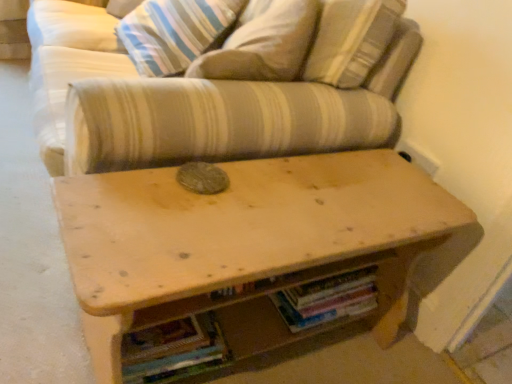
Question: From a real-world perspective, is striped fabric couch at center positioned above or below hardcover books at center, which ranks as the 2th book in left-to-right order?

Choices:
 (A) above
 (B) below

Answer: (A)

Question: In terms of height, does striped fabric couch at center look taller or shorter compared to hardcover books at center, which ranks as the 2th book in left-to-right order?

Choices:
 (A) tall
 (B) short

Answer: (A)

Question: Which object is the farthest from the hardcover books at center, the 1th book viewed from the right?

Choices:
 (A) striped fabric couch at center
 (B) wooden table at center
 (C) striped fabric pillow at upper center
 (D) multicolored paper book at lower center, acting as the 1th book starting from the left

Answer: (C)

Question: Based on their relative distances, which object is nearer to the wooden table at center?

Choices:
 (A) striped fabric pillow at upper center
 (B) striped fabric couch at center
 (C) multicolored paper book at lower center, acting as the 1th book starting from the left
 (D) hardcover books at center, the 1th book viewed from the right

Answer: (D)